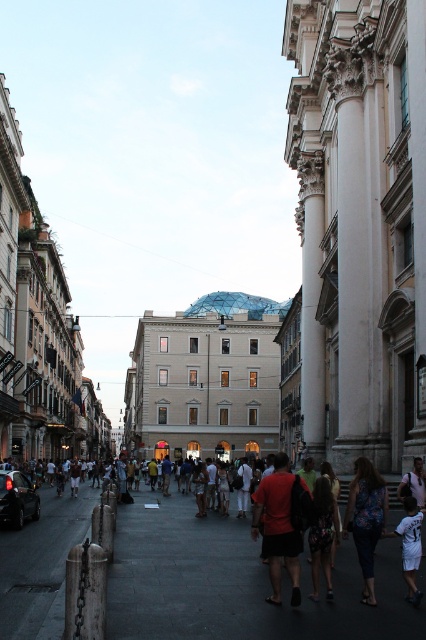
You are a fashion designer observing two shirts in an urban setting. The scene shows a European city street with historic buildings and a central dome. You notice the red matte shirt at center and the white cotton shirt at lower right. Which shirt is taller?

The red matte shirt at center is taller than the white cotton shirt at lower right.

You are a photographer standing on the street and want to take a picture of the white cotton shirt at lower right without the matte black crowd at center blocking it. What should you do?

The matte black crowd at center is in front of the white cotton shirt at lower right, so you should move to a position where the crowd is no longer between you and the shirt, or adjust your angle to capture the shirt without the crowd obstructing the view.